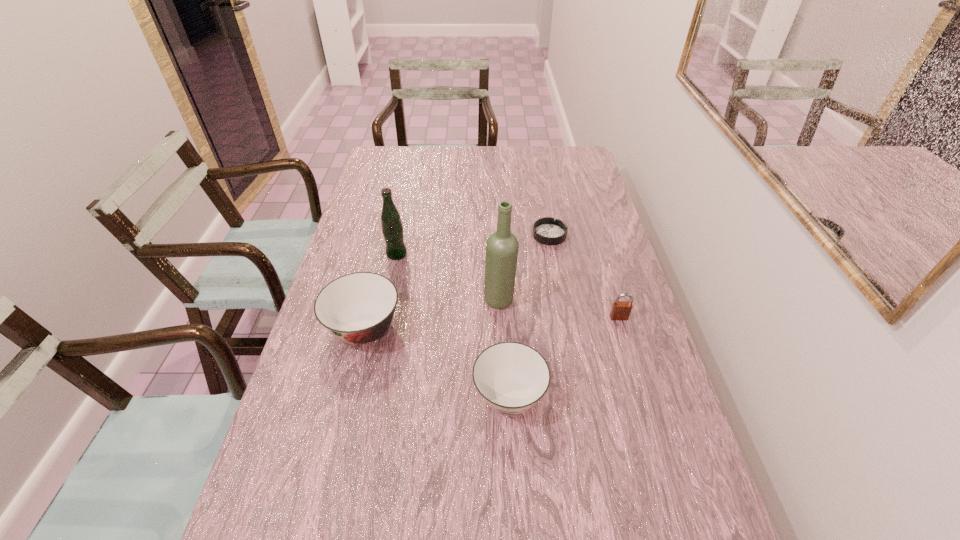
This screenshot has width=960, height=540. In the image, there is a desktop. In order to click on vacant region at the far edge in this screenshot , I will do `click(475, 150)`.

The image size is (960, 540). Find the location of `free space at the near edge of the desktop`. free space at the near edge of the desktop is located at coordinates (429, 488).

Where is `vacant space at the left edge of the desktop`? vacant space at the left edge of the desktop is located at coordinates (372, 252).

Where is `vacant space at the right edge`? This screenshot has height=540, width=960. vacant space at the right edge is located at coordinates (603, 248).

Identify the location of vacant space at the far left corner of the desktop. The height and width of the screenshot is (540, 960). (384, 146).

You are a GUI agent. You are given a task and a screenshot of the screen. Output one action in this format:
    pyautogui.click(x=<x>, y=<y>)
    Task: Click on the free space at the far right corner of the desktop
    Image resolution: width=960 pixels, height=540 pixels.
    Given the screenshot: What is the action you would take?
    pyautogui.click(x=560, y=160)

Find the location of `unoccupied position between the fifth shortest object and the wine bottle`. unoccupied position between the fifth shortest object and the wine bottle is located at coordinates (448, 277).

Find the location of `vacant area between the wine bottle and the farthest object`. vacant area between the wine bottle and the farthest object is located at coordinates (524, 268).

Find the location of a particular element. The width and height of the screenshot is (960, 540). vacant area between the taller soup bowl and the tallest object is located at coordinates (432, 315).

Locate an element on the screen. This screenshot has width=960, height=540. unoccupied position between the second farthest object and the wine bottle is located at coordinates (448, 277).